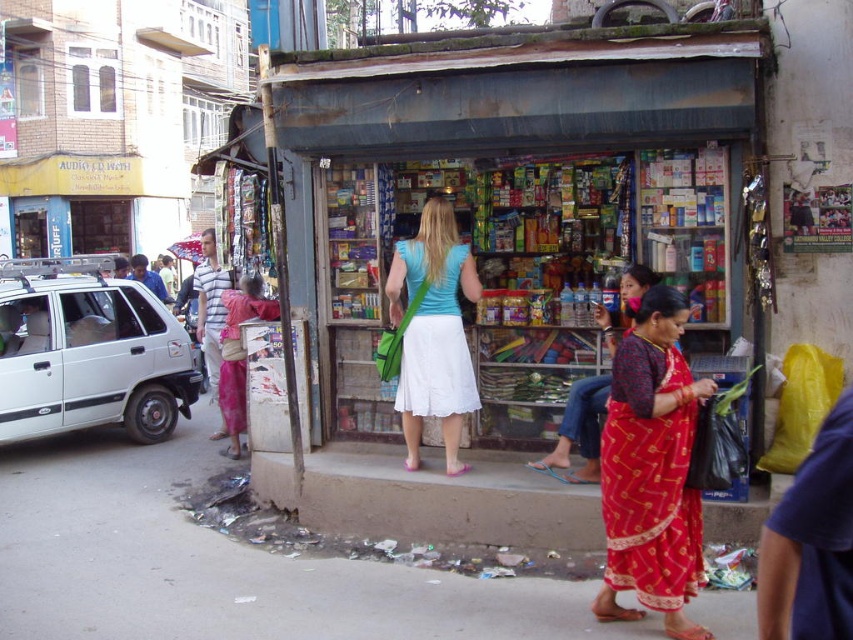
Question: Is dirty concrete pavement at lower center smaller than red printed sari at lower right?

Choices:
 (A) yes
 (B) no

Answer: (A)

Question: Can you confirm if dirty concrete pavement at lower center is smaller than brown concrete curb at lower center?

Choices:
 (A) no
 (B) yes

Answer: (B)

Question: Does brown concrete curb at lower center come in front of red silk saree at center?

Choices:
 (A) no
 (B) yes

Answer: (B)

Question: Which object is farther from the camera taking this photo?

Choices:
 (A) brown concrete curb at lower center
 (B) light blue fabric shirt at center

Answer: (B)

Question: Which of the following is the closest to the observer?

Choices:
 (A) brown concrete curb at lower center
 (B) light blue fabric shirt at center
 (C) red printed sari at lower right
 (D) dirty concrete pavement at lower center

Answer: (C)

Question: Which object is closer to the camera taking this photo?

Choices:
 (A) brown concrete curb at lower center
 (B) light blue fabric shirt at center
 (C) red printed sari at lower right
 (D) dirty concrete pavement at lower center

Answer: (C)